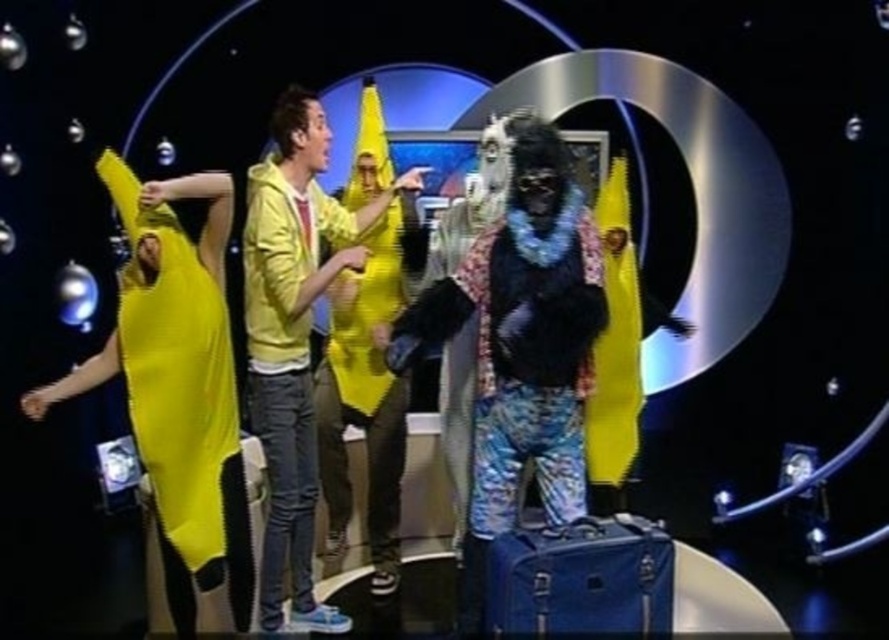
Does rubberized yellow banana at left come in front of matte yellow banana at center?

Yes, rubberized yellow banana at left is closer to the viewer.

Locate an element on the screen. Image resolution: width=889 pixels, height=640 pixels. rubberized yellow banana at left is located at coordinates (175, 385).

Find the location of a particular element. This screenshot has height=640, width=889. rubberized yellow banana at left is located at coordinates (175, 385).

Who is more forward, [250,237] or [599,189]?

Positioned in front is point [250,237].

Can you confirm if yellow matte banana at center is smaller than matte yellow banana at center?

No.

This screenshot has width=889, height=640. I want to click on yellow matte banana at center, so click(x=295, y=339).

This screenshot has height=640, width=889. In order to click on rubberized yellow banana at left in this screenshot , I will do `click(175, 385)`.

Measure the distance between point (x=196, y=248) and camera.

Point (x=196, y=248) and camera are 2.92 meters apart from each other.

Identify the location of rubberized yellow banana at left. (175, 385).

At what (x,y) coordinates should I click in order to perform the action: click on rubberized yellow banana at left. Please return your answer as a coordinate pair (x, y). The width and height of the screenshot is (889, 640). Looking at the image, I should click on (175, 385).